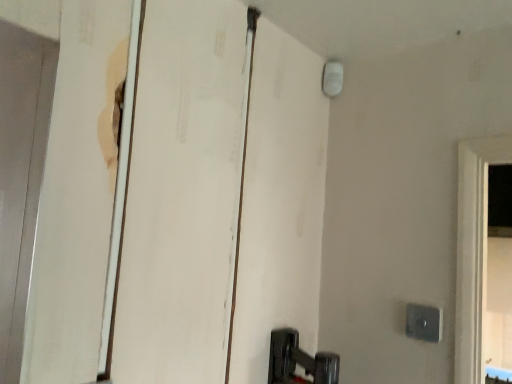
Describe the element at coordinates (424, 322) in the screenshot. Image resolution: width=512 pixels, height=384 pixels. I see `satin silver switch at lower right` at that location.

Identify the location of satin silver switch at lower right. Image resolution: width=512 pixels, height=384 pixels. (424, 322).

You are a GUI agent. You are given a task and a screenshot of the screen. Output one action in this format:
    pyautogui.click(x=<x>, y=<y>)
    Task: Click on the satin silver switch at lower right
    The width and height of the screenshot is (512, 384).
    Given the screenshot: What is the action you would take?
    pyautogui.click(x=424, y=322)